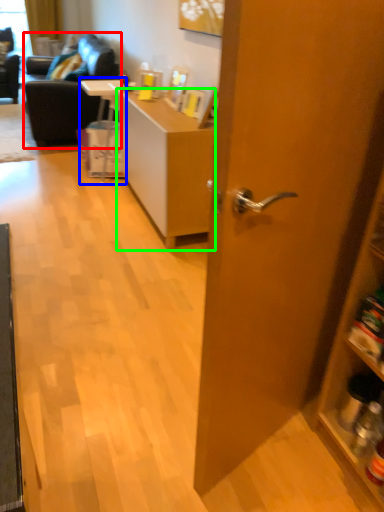
Question: Considering the real-world distances, which object is closest to studio couch (highlighted by a red box)? table (highlighted by a blue box) or desk (highlighted by a green box).

Choices:
 (A) table
 (B) desk

Answer: (A)